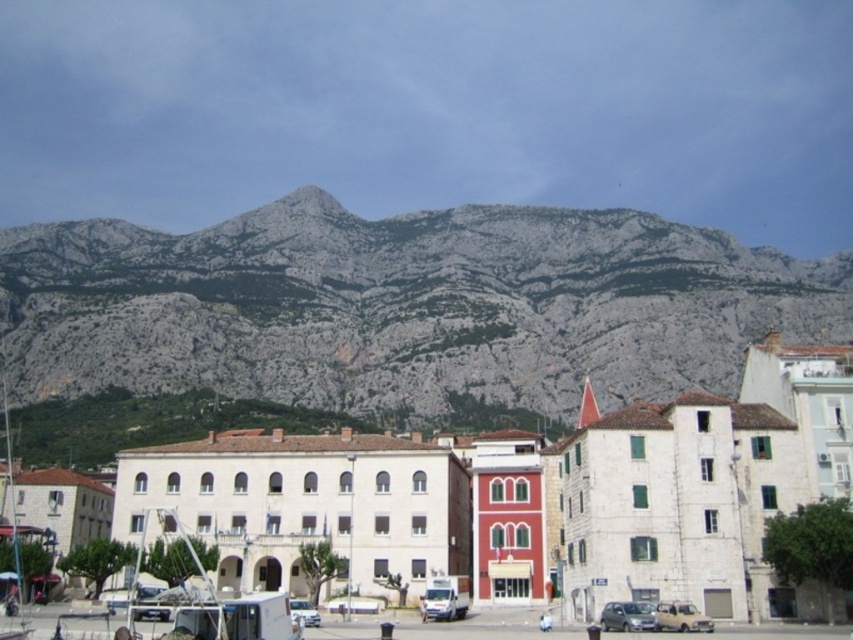
Question: Where is satin silver car at lower center located in relation to white matte van at center in the image?

Choices:
 (A) below
 (B) above

Answer: (B)

Question: Does gray rock mountain at upper center have a greater width compared to white stone buildings at center?

Choices:
 (A) yes
 (B) no

Answer: (A)

Question: Which object is the closest to the white stone buildings at center?

Choices:
 (A) white matte van at center
 (B) gray rock mountain at upper center
 (C) light brown matte car at lower right
 (D) satin silver car at lower center

Answer: (C)

Question: Is white stone buildings at center to the left of light brown matte car at lower right from the viewer's perspective?

Choices:
 (A) no
 (B) yes

Answer: (B)

Question: Which object is closer to the camera taking this photo?

Choices:
 (A) light brown matte car at lower right
 (B) gray rock mountain at upper center
 (C) satin silver car at lower center

Answer: (C)

Question: Which point is farther from the camera taking this photo?

Choices:
 (A) (47, 248)
 (B) (300, 605)
 (C) (753, 497)
 (D) (688, 621)

Answer: (A)